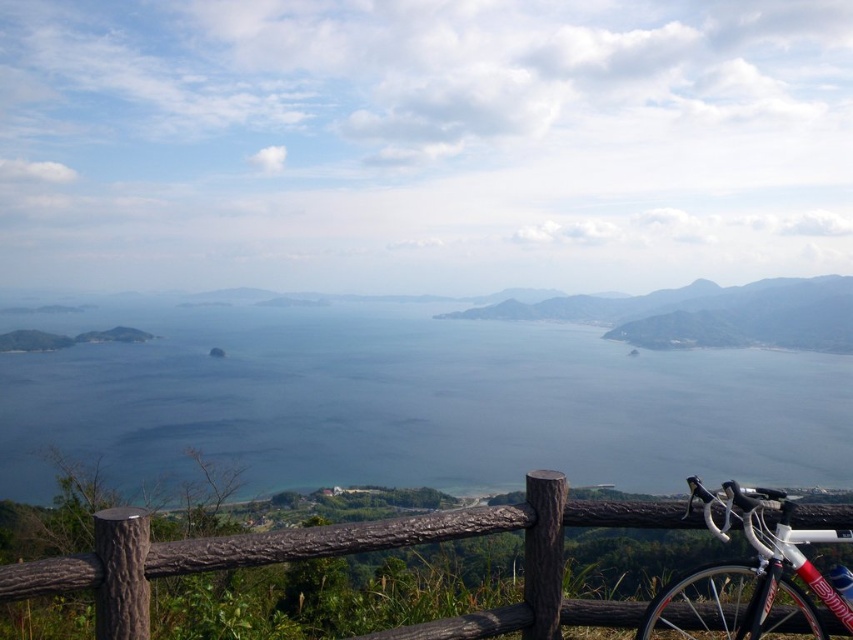
Question: Considering the relative positions of blue water at center and brown wooden fence at lower center in the image provided, where is blue water at center located with respect to brown wooden fence at lower center?

Choices:
 (A) right
 (B) left

Answer: (A)

Question: Which of the following is the farthest from the observer?

Choices:
 (A) brown wooden fence at lower center
 (B) white metallic mountain bike at lower right
 (C) blue water at center

Answer: (C)

Question: Is brown wooden fence at lower center in front of white metallic mountain bike at lower right?

Choices:
 (A) no
 (B) yes

Answer: (B)

Question: Estimate the real-world distances between objects in this image. Which object is farther from the brown wooden fence at lower center?

Choices:
 (A) blue water at center
 (B) white metallic mountain bike at lower right

Answer: (A)

Question: Does brown wooden fence at lower center appear under white metallic mountain bike at lower right?

Choices:
 (A) no
 (B) yes

Answer: (A)

Question: Among these objects, which one is farthest from the camera?

Choices:
 (A) brown wooden fence at lower center
 (B) blue water at center
 (C) white metallic mountain bike at lower right

Answer: (B)